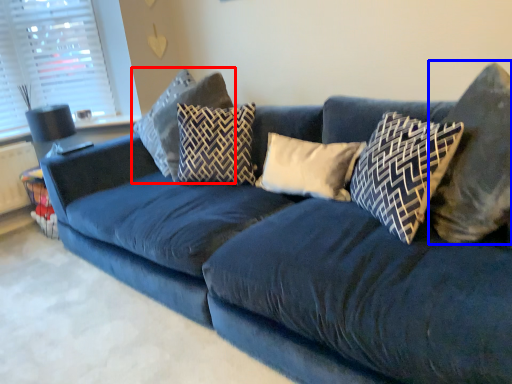
Question: Which point is further to the camera, pillow (highlighted by a red box) or pillow (highlighted by a blue box)?

Choices:
 (A) pillow
 (B) pillow

Answer: (A)